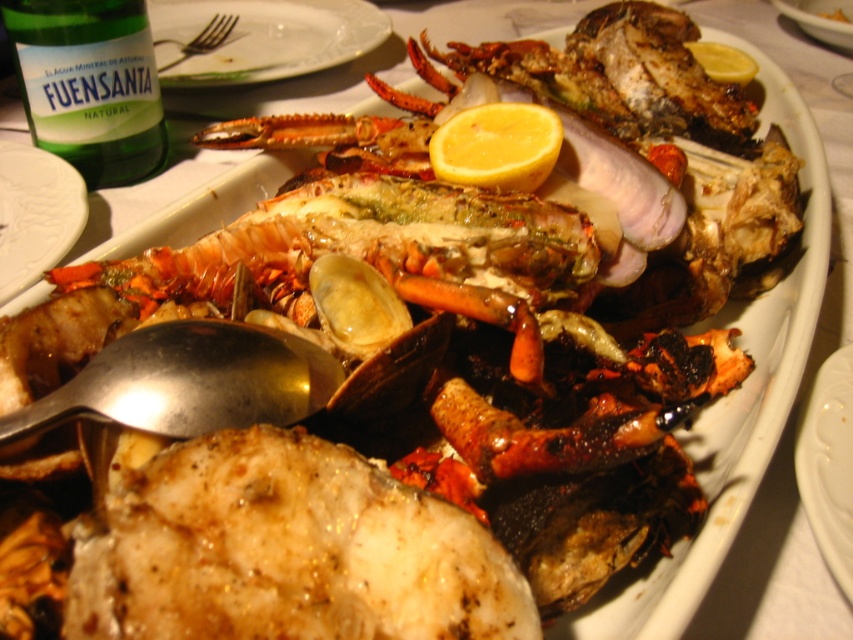
Question: Is green glass bottle at upper left to the left of yellow smooth lemon at center from the viewer's perspective?

Choices:
 (A) yes
 (B) no

Answer: (A)

Question: Is matte white plate at upper left positioned at the back of white glossy plate at center?

Choices:
 (A) yes
 (B) no

Answer: (A)

Question: Which object is farther from the camera taking this photo?

Choices:
 (A) yellow smooth lemon at upper right
 (B) green glass bottle at upper left

Answer: (A)

Question: Is white glossy plate at center positioned behind yellow smooth lemon at center?

Choices:
 (A) yes
 (B) no

Answer: (B)

Question: Which object is closer to the camera taking this photo?

Choices:
 (A) white glossy plate at center
 (B) yellow smooth lemon at center

Answer: (A)

Question: Which point is farther from the camera taking this photo?

Choices:
 (A) (711, 61)
 (B) (64, 240)

Answer: (A)